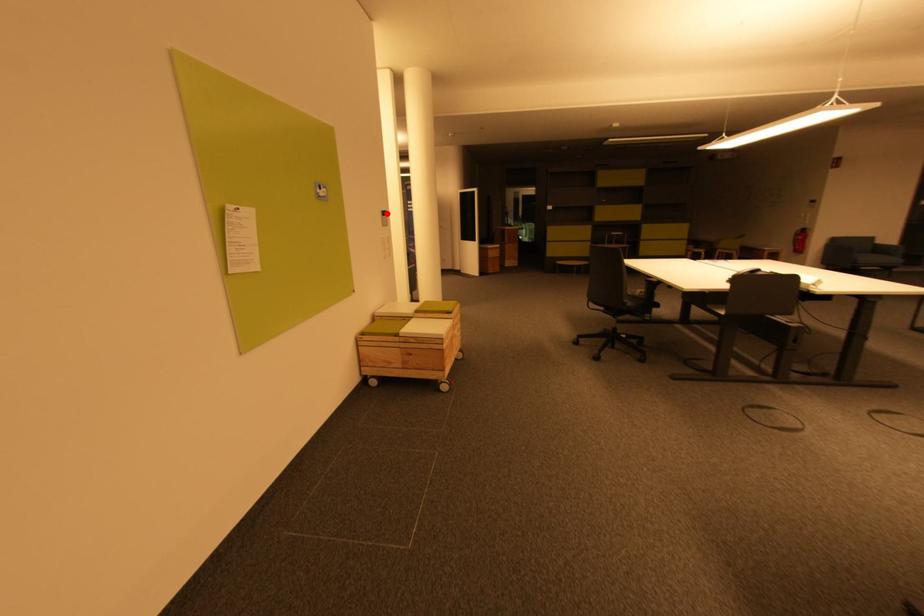
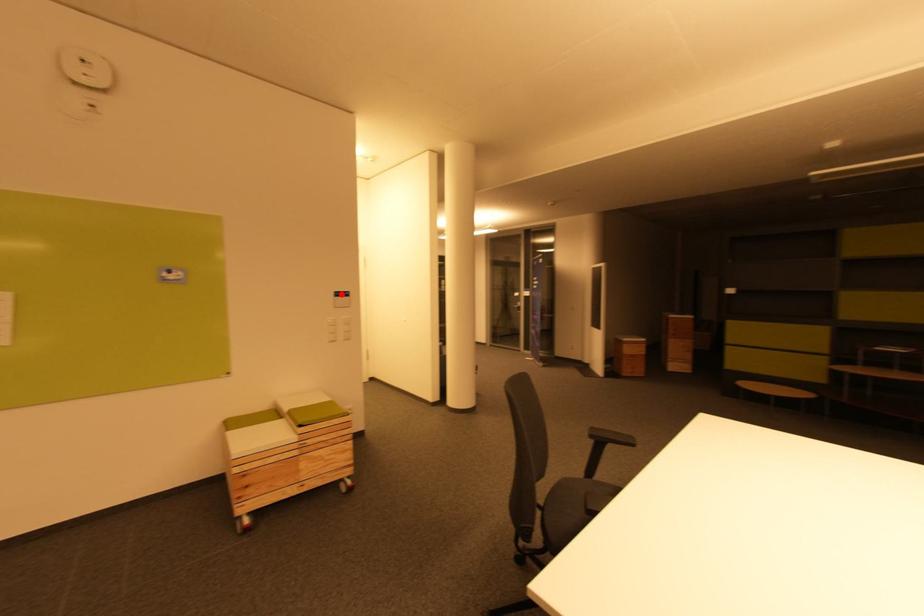
I am providing you with two images of the same scene from different viewpoints. A red point is marked on the first image and another point is marked on the second image. Is the red point in image1 aligned with the point shown in image2?

Yes